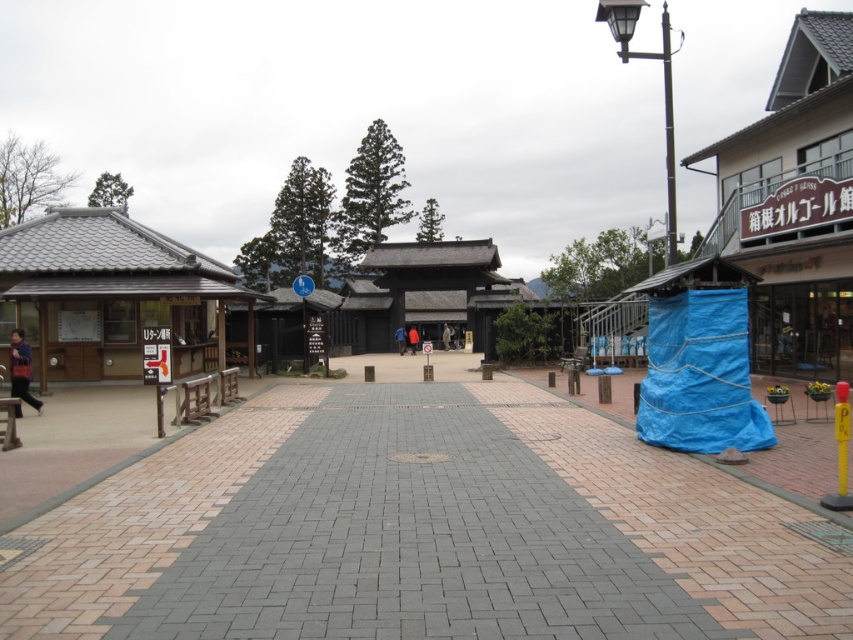
You are a tourist visiting this Japanese site and want to take a photo of the brick paved walkway at center and the wooden signboard at left. Which object is shorter in height?

The brick paved walkway at center is not as tall as the wooden signboard at left, so the brick paved walkway at center is shorter in height.

Looking at this image, you are standing at the entrance of the traditional Japanese site and want to reach the central structure. There are two points marked on the walkway. Which point is closer to you, point (271, 468) or point (15, 272)?

Point (271, 468) is closer to you than point (15, 272).

In the scene shown: You are a tour guide leading a group through this Japanese cultural site. You want to ensure everyone stays within the safe path marked by the brick paved walkway at center. If the average stride length of your group members is 0.75 meters, how many steps will it take for them to reach the walkway from where you are standing?

The brick paved walkway at center is 3.63 meters away. Dividing the distance by the average stride length of 0.75 meters gives approximately 4.84 steps. Since you can only take whole steps, it would take around 5 steps to reach the walkway.